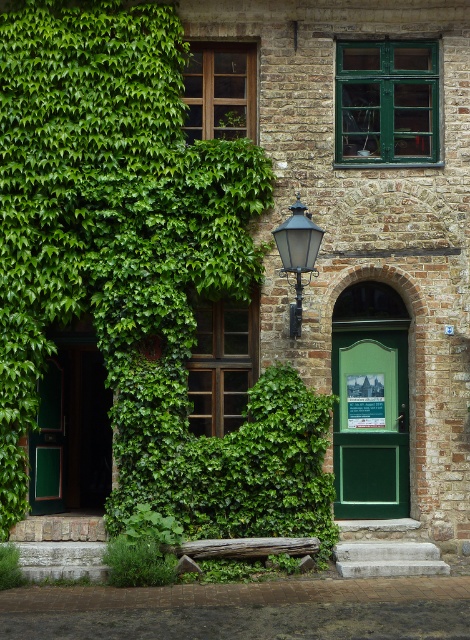
Can you confirm if green matte door at center is smaller than green leafy plant at lower center?

Incorrect, green matte door at center is not smaller in size than green leafy plant at lower center.

Which is in front, point (406, 365) or point (147, 577)?

Point (147, 577)

Identify the location of green matte door at center. 370,422.

Looking at this image, does green matte door at center appear on the right side of green leafy plant at lower left?

Correct, you'll find green matte door at center to the right of green leafy plant at lower left.

Who is more forward, (369, 387) or (17, 554)?

Point (17, 554) is in front.

Where is `green matte door at center`? green matte door at center is located at coordinates (370, 422).

Is matte black lamp post at center to the left of green leafy plant at lower left from the viewer's perspective?

No, matte black lamp post at center is not to the left of green leafy plant at lower left.

At what (x,y) coordinates should I click in order to perform the action: click on matte black lamp post at center. Please return your answer as a coordinate pair (x, y). Image resolution: width=470 pixels, height=640 pixels. Looking at the image, I should click on (297, 253).

I want to click on matte black lamp post at center, so click(297, 253).